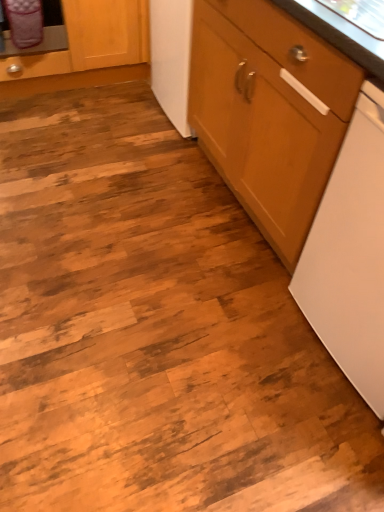
Question: Does wooden cabinet at right, the first cabinetry positioned from the right, appear on the left side of white matte dishwasher at right?

Choices:
 (A) yes
 (B) no

Answer: (A)

Question: Can you see wooden cabinet at right, the 2th cabinetry positioned from the left, touching white matte dishwasher at right?

Choices:
 (A) no
 (B) yes

Answer: (A)

Question: Is white matte dishwasher at right surrounded by wooden cabinet at right, the 2th cabinetry positioned from the left?

Choices:
 (A) no
 (B) yes

Answer: (A)

Question: Is wooden cabinet at right, the 2th cabinetry positioned from the left, thinner than white matte dishwasher at right?

Choices:
 (A) yes
 (B) no

Answer: (B)

Question: Can you confirm if wooden cabinet at right, the 2th cabinetry positioned from the left, is positioned to the right of white matte dishwasher at right?

Choices:
 (A) no
 (B) yes

Answer: (A)

Question: Considering the relative positions of white matte dishwasher at right and wooden cabinet at upper left, the first cabinetry when ordered from left to right, in the image provided, is white matte dishwasher at right to the left or to the right of wooden cabinet at upper left, the first cabinetry when ordered from left to right,?

Choices:
 (A) right
 (B) left

Answer: (A)

Question: Would you say white matte dishwasher at right is inside or outside wooden cabinet at upper left, the first cabinetry when ordered from left to right?

Choices:
 (A) inside
 (B) outside

Answer: (B)

Question: From the image's perspective, is white matte dishwasher at right positioned above or below wooden cabinet at upper left, arranged as the 2th cabinetry when viewed from the right?

Choices:
 (A) below
 (B) above

Answer: (A)

Question: Is white matte dishwasher at right bigger or smaller than wooden cabinet at upper left, arranged as the 2th cabinetry when viewed from the right?

Choices:
 (A) big
 (B) small

Answer: (B)

Question: From the image's perspective, relative to wooden cabinet at right, the 2th cabinetry positioned from the left, is wooden cabinet at upper left, arranged as the 2th cabinetry when viewed from the right, above or below?

Choices:
 (A) above
 (B) below

Answer: (A)

Question: In terms of size, does wooden cabinet at upper left, arranged as the 2th cabinetry when viewed from the right, appear bigger or smaller than wooden cabinet at right, the 2th cabinetry positioned from the left?

Choices:
 (A) big
 (B) small

Answer: (B)

Question: Based on their positions, is wooden cabinet at upper left, arranged as the 2th cabinetry when viewed from the right, located to the left or right of wooden cabinet at right, the 2th cabinetry positioned from the left?

Choices:
 (A) right
 (B) left

Answer: (B)

Question: From a real-world perspective, relative to wooden cabinet at right, the 2th cabinetry positioned from the left, is wooden cabinet at upper left, the first cabinetry when ordered from left to right, vertically above or below?

Choices:
 (A) above
 (B) below

Answer: (B)

Question: From a real-world perspective, is white matte dishwasher at right positioned above or below wooden cabinet at right, the 2th cabinetry positioned from the left?

Choices:
 (A) above
 (B) below

Answer: (B)

Question: Does point (339, 351) appear closer or farther from the camera than point (241, 126)?

Choices:
 (A) farther
 (B) closer

Answer: (B)